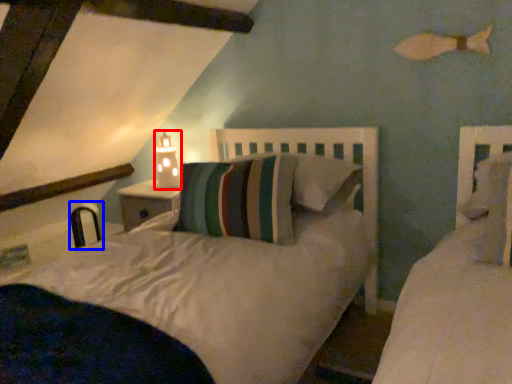
Question: Among these objects, which one is farthest to the camera, table lamp (highlighted by a red box) or chair (highlighted by a blue box)?

Choices:
 (A) table lamp
 (B) chair

Answer: (B)